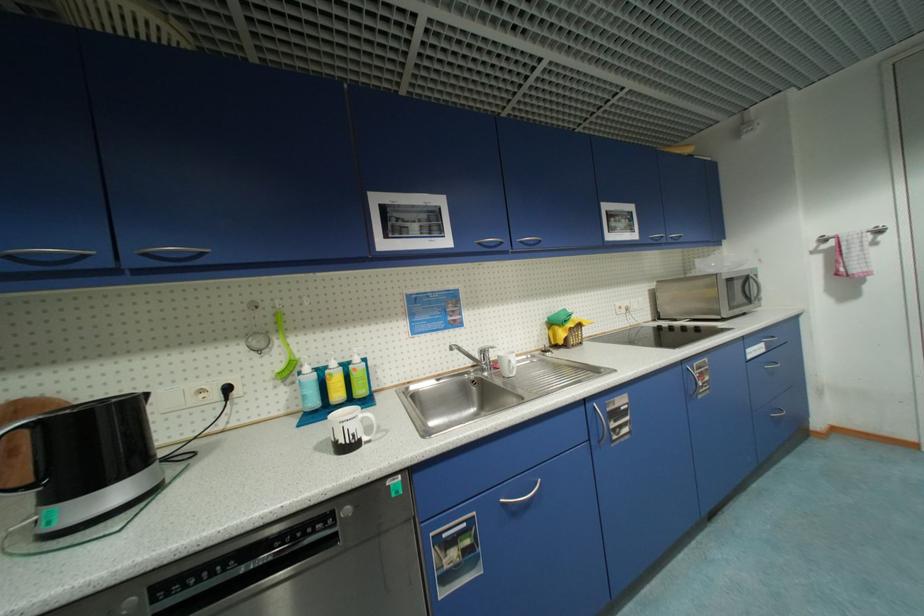
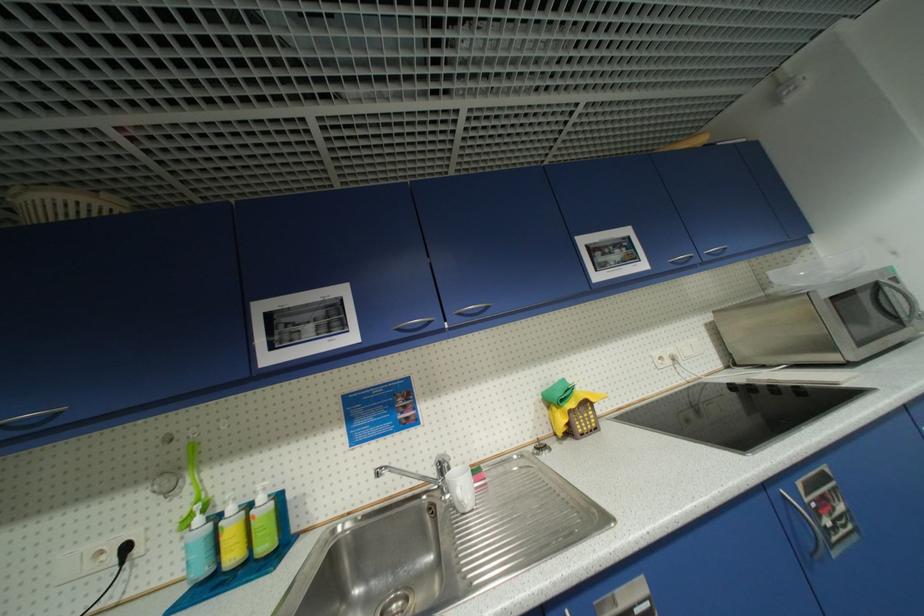
Find the pixel in the second image that matches (x=485, y=245) in the first image.

(405, 331)